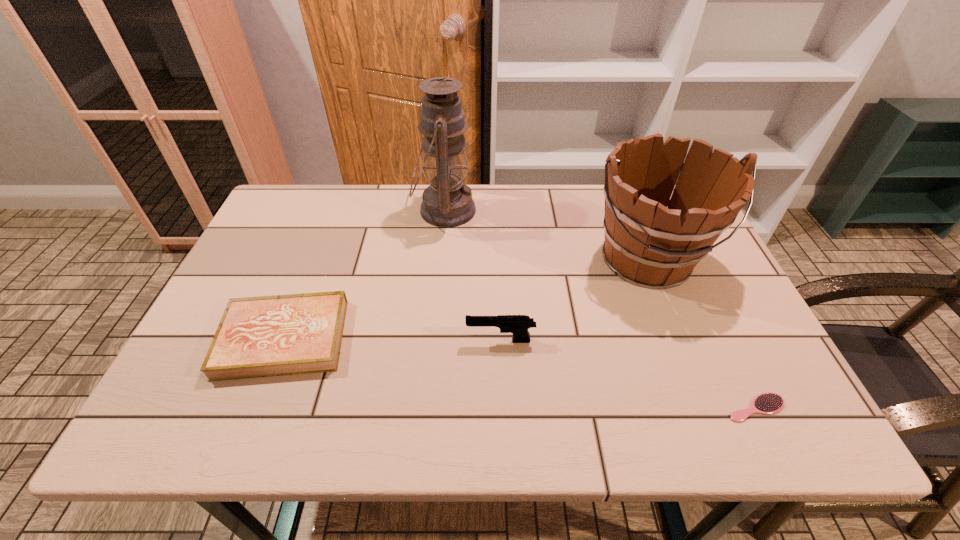
This screenshot has width=960, height=540. I want to click on oil lamp, so click(x=447, y=202).

This screenshot has height=540, width=960. I want to click on the second tallest object, so click(650, 245).

Identify the location of the third shortest object. Image resolution: width=960 pixels, height=540 pixels. tap(518, 325).

Where is `the leftmost object`? The height and width of the screenshot is (540, 960). the leftmost object is located at coordinates (264, 336).

You are a GUI agent. You are given a task and a screenshot of the screen. Output one action in this format:
    pyautogui.click(x=<x>, y=<y>)
    Task: Click on the hardback book
    
    Given the screenshot: What is the action you would take?
    pyautogui.click(x=264, y=336)

You are a GUI agent. You are given a task and a screenshot of the screen. Output one action in this format:
    pyautogui.click(x=<x>, y=<y>)
    Task: Click on the hairbrush
    This screenshot has height=540, width=960.
    Given the screenshot: What is the action you would take?
    pyautogui.click(x=767, y=403)

You are a GUI agent. You are given a task and a screenshot of the screen. Output one action in this format:
    pyautogui.click(x=<x>, y=<y>)
    Task: Click on the shortest object
    This screenshot has width=960, height=540.
    Given the screenshot: What is the action you would take?
    pyautogui.click(x=767, y=403)

Where is `vacant space situated 0.230m on the right of the tallest object`? vacant space situated 0.230m on the right of the tallest object is located at coordinates (550, 211).

Image resolution: width=960 pixels, height=540 pixels. Find the location of `blank area located 0.300m with the handle on the second tallest object`. blank area located 0.300m with the handle on the second tallest object is located at coordinates (708, 416).

Locate an element on the screen. Image resolution: width=960 pixels, height=540 pixels. vacant space positioned 0.130m on the front-facing side of the third shortest object is located at coordinates (410, 341).